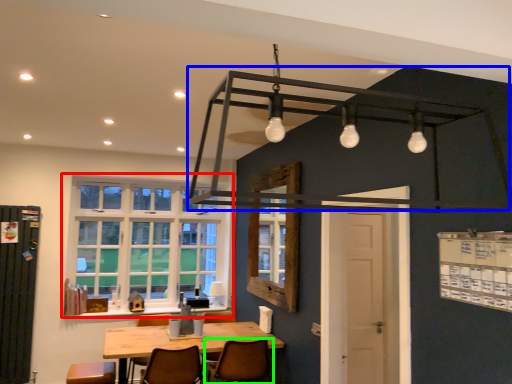
Question: Estimate the real-world distances between objects in this image. Which object is closer to window (highlighted by a red box), bunk bed (highlighted by a blue box) or chair (highlighted by a green box)?

Choices:
 (A) bunk bed
 (B) chair

Answer: (B)